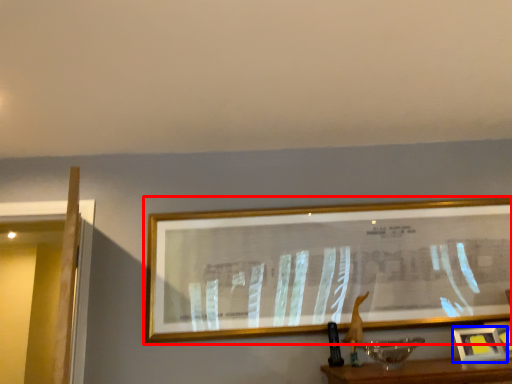
Question: Which point is closer to the camera, picture frame (highlighted by a red box) or picture frame (highlighted by a blue box)?

Choices:
 (A) picture frame
 (B) picture frame

Answer: (B)